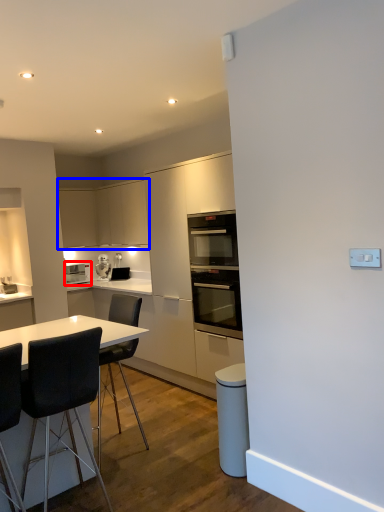
Question: Which point is further to the camera, home appliance (highlighted by a red box) or cabinetry (highlighted by a blue box)?

Choices:
 (A) home appliance
 (B) cabinetry

Answer: (A)